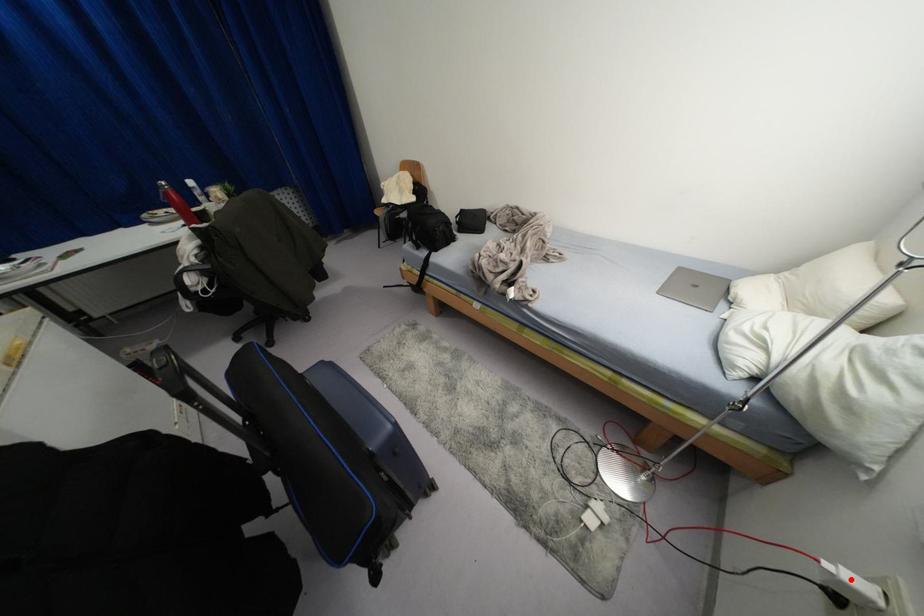
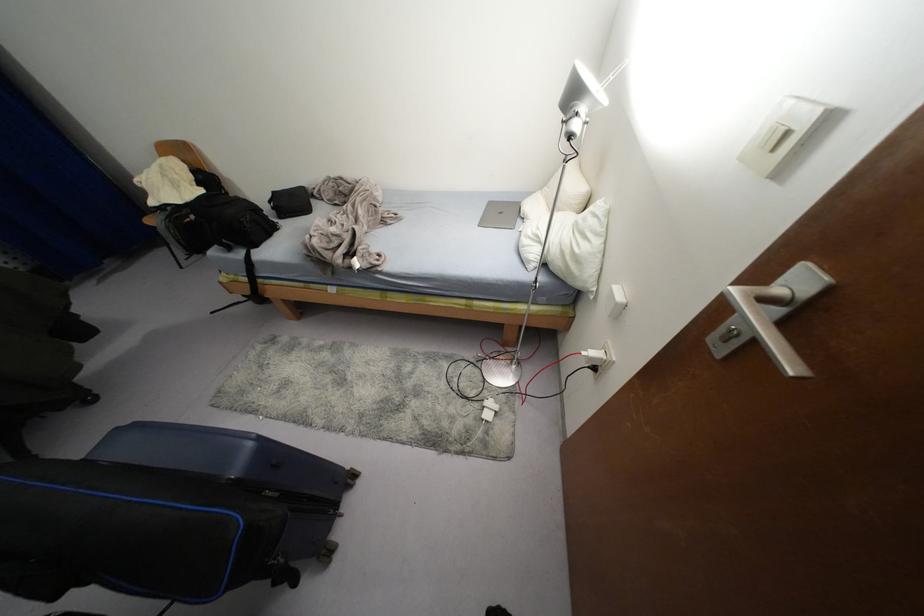
Where in the second image is the point corresponding to the highlighted location from the first image?

(592, 353)